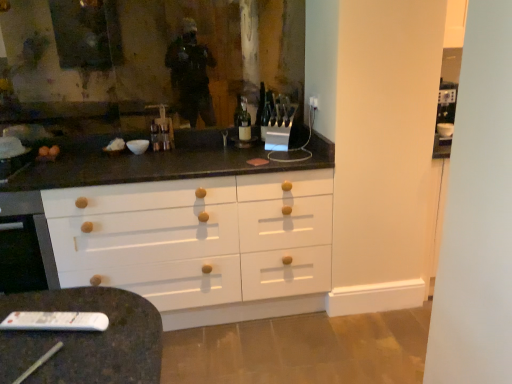
Describe the element at coordinates (244, 121) in the screenshot. Image resolution: width=512 pixels, height=384 pixels. I see `matte glass bottle at center` at that location.

The width and height of the screenshot is (512, 384). Find the location of `matte glass bottle at center`. matte glass bottle at center is located at coordinates (244, 121).

The image size is (512, 384). Find the location of `white plastic remote at lower left`. white plastic remote at lower left is located at coordinates (55, 321).

What is the approximate height of white plastic remote at lower left?

white plastic remote at lower left is 1.01 inches in height.

The image size is (512, 384). Describe the element at coordinates (55, 321) in the screenshot. I see `white plastic remote at lower left` at that location.

Where is `matte glass bottle at center`? This screenshot has width=512, height=384. matte glass bottle at center is located at coordinates (244, 121).

Based on their positions, is matte glass bottle at center located to the left or right of white plastic remote at lower left?

matte glass bottle at center is to the right of white plastic remote at lower left.

Is matte glass bottle at center behind white plastic remote at lower left?

That is True.

Is point (242, 116) behind point (36, 315)?

Yes, point (242, 116) is farther from viewer.

From the image's perspective, is matte glass bottle at center positioned above or below white plastic remote at lower left?

From the image's perspective, matte glass bottle at center appears above white plastic remote at lower left.

From a real-world perspective, does matte glass bottle at center sit lower than white plastic remote at lower left?

No, from a real-world perspective, matte glass bottle at center is not under white plastic remote at lower left.

Is matte glass bottle at center wider than white plastic remote at lower left?

Correct, the width of matte glass bottle at center exceeds that of white plastic remote at lower left.

Which of these two, matte glass bottle at center or white plastic remote at lower left, stands shorter?

white plastic remote at lower left.

Consider the image. Which of these two, matte glass bottle at center or white plastic remote at lower left, is smaller?

With smaller size is white plastic remote at lower left.

Is matte glass bottle at center located outside white plastic remote at lower left?

That's correct, matte glass bottle at center is outside of white plastic remote at lower left.

From the picture: Would you say matte glass bottle at center is a long distance from white plastic remote at lower left?

Indeed, matte glass bottle at center is not near white plastic remote at lower left.

From the picture: Could you tell me if matte glass bottle at center is facing white plastic remote at lower left?

No, matte glass bottle at center does not turn towards white plastic remote at lower left.

Consider the image. How different are the orientations of matte glass bottle at center and white plastic remote at lower left in degrees?

15.6 degrees separate the facing orientations of matte glass bottle at center and white plastic remote at lower left.

There is a white plastic remote at lower left. Where is `bottle above it (from a real-world perspective)`? Image resolution: width=512 pixels, height=384 pixels. bottle above it (from a real-world perspective) is located at coordinates (244, 121).

Considering the positions of objects white plastic remote at lower left and matte glass bottle at center in the image provided, who is more to the right, white plastic remote at lower left or matte glass bottle at center?

From the viewer's perspective, matte glass bottle at center appears more on the right side.

Which object is further away from the camera, white plastic remote at lower left or matte glass bottle at center?

matte glass bottle at center is further from the camera.

Which point is more distant from viewer, (79, 320) or (242, 96)?

The point (242, 96) is farther.

From the image's perspective, is white plastic remote at lower left above matte glass bottle at center?

No, from the image's perspective, white plastic remote at lower left is not above matte glass bottle at center.

Looking at this image, from a real-world perspective, is white plastic remote at lower left on matte glass bottle at center?

No, from a real-world perspective, white plastic remote at lower left is not on top of matte glass bottle at center.

Which of these two, white plastic remote at lower left or matte glass bottle at center, is thinner?

Thinner between the two is white plastic remote at lower left.

From their relative heights in the image, would you say white plastic remote at lower left is taller or shorter than matte glass bottle at center?

In the image, white plastic remote at lower left appears to be shorter than matte glass bottle at center.

Does white plastic remote at lower left have a smaller size compared to matte glass bottle at center?

Correct, white plastic remote at lower left occupies less space than matte glass bottle at center.

Looking at this image, is matte glass bottle at center located within white plastic remote at lower left?

No, matte glass bottle at center is not surrounded by white plastic remote at lower left.

Is white plastic remote at lower left placed right next to matte glass bottle at center?

white plastic remote at lower left is not next to matte glass bottle at center, and they're not touching.

Is white plastic remote at lower left facing towards matte glass bottle at center?

No, white plastic remote at lower left does not turn towards matte glass bottle at center.

How many degrees apart are the facing directions of white plastic remote at lower left and matte glass bottle at center?

The angle between the facing direction of white plastic remote at lower left and the facing direction of matte glass bottle at center is 15.6 degrees.

Identify the location of remote that appears in front of the matte glass bottle at center. (55, 321).

Image resolution: width=512 pixels, height=384 pixels. I want to click on remote below the matte glass bottle at center (from a real-world perspective), so click(x=55, y=321).

In the image, there is a white plastic remote at lower left. At what (x,y) coordinates should I click in order to perform the action: click on bottle above it (from the image's perspective). Please return your answer as a coordinate pair (x, y). Looking at the image, I should click on (244, 121).